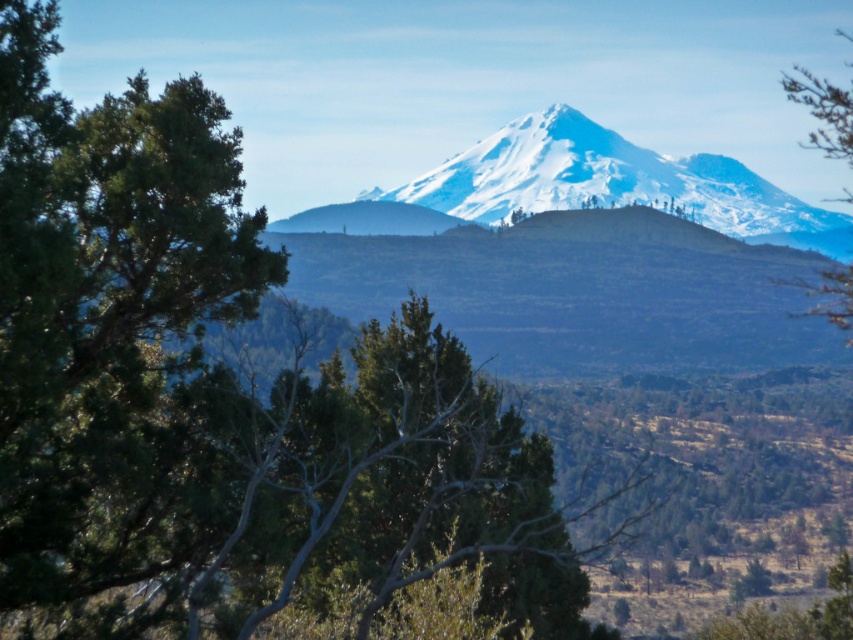
Question: Can you confirm if snowy white mountain at center is smaller than green matte tree at right?

Choices:
 (A) yes
 (B) no

Answer: (A)

Question: Is snowy white mountain at center above green matte tree at right?

Choices:
 (A) yes
 (B) no

Answer: (A)

Question: Where is snowy white mountain at center located in relation to green matte tree at right in the image?

Choices:
 (A) right
 (B) left

Answer: (B)

Question: Which point is closer to the camera taking this photo?

Choices:
 (A) (848, 99)
 (B) (561, 138)

Answer: (A)